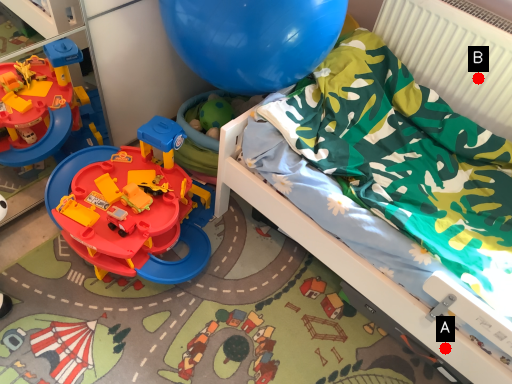
Question: Two points are circled on the image, labeled by A and B beside each circle. Which point is farther to the camera?

Choices:
 (A) A is further
 (B) B is further

Answer: (B)